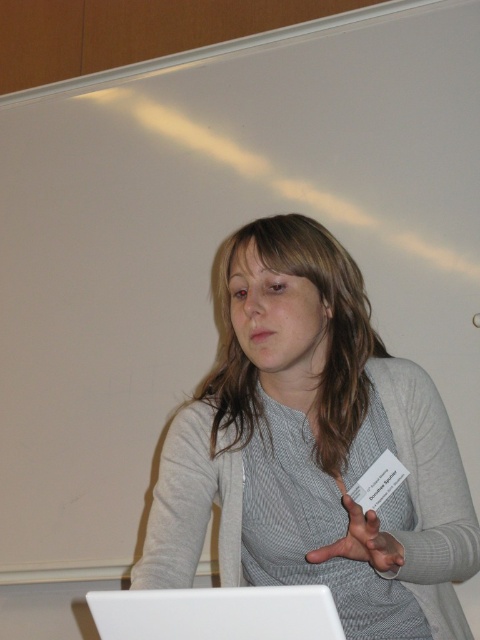
Question: Does gray matte sweater at center lie behind matte gray hand at center?

Choices:
 (A) no
 (B) yes

Answer: (B)

Question: Is gray matte sweater at center thinner than white plastic laptop at lower center?

Choices:
 (A) no
 (B) yes

Answer: (A)

Question: Which is farther from the gray matte sweater at center?

Choices:
 (A) white plastic laptop at lower center
 (B) matte gray hand at center

Answer: (A)

Question: Can you confirm if gray matte sweater at center is positioned to the left of matte gray hand at center?

Choices:
 (A) no
 (B) yes

Answer: (B)

Question: Which of the following is the farthest from the observer?

Choices:
 (A) white plastic laptop at lower center
 (B) gray matte sweater at center
 (C) matte gray hand at center

Answer: (B)

Question: Which point is closer to the camera taking this photo?

Choices:
 (A) (424, 525)
 (B) (101, 604)

Answer: (B)